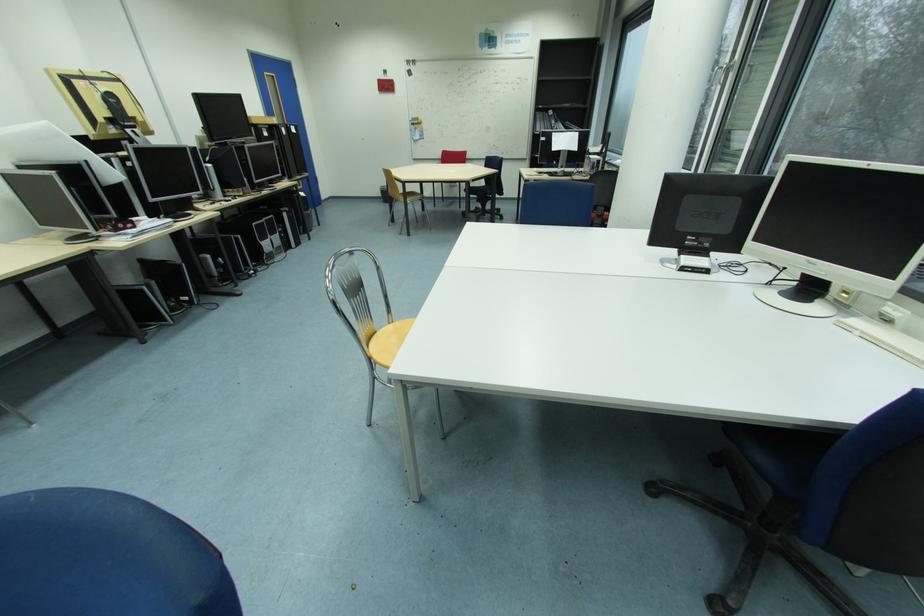
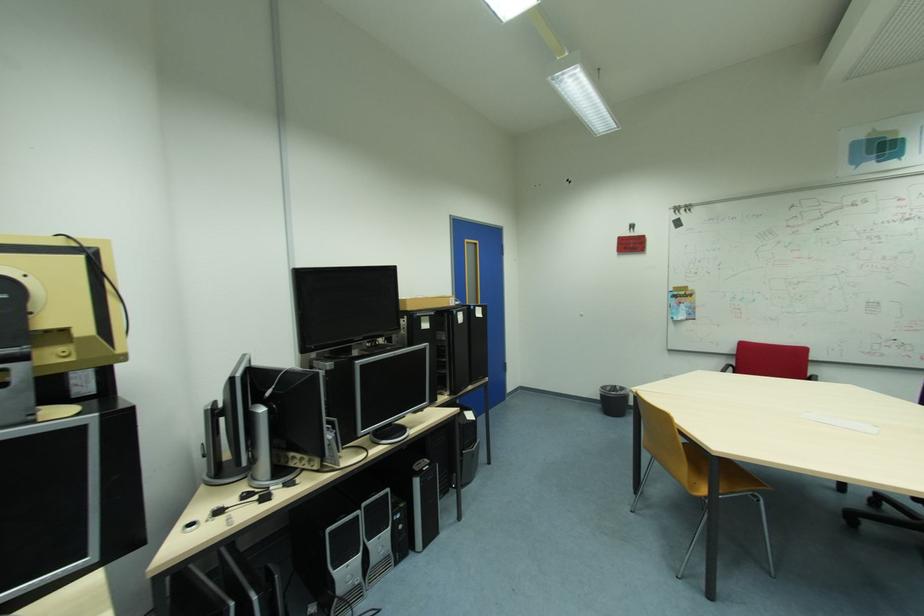
Find the pixel in the second image that matches (261,225) in the first image.

(335, 530)